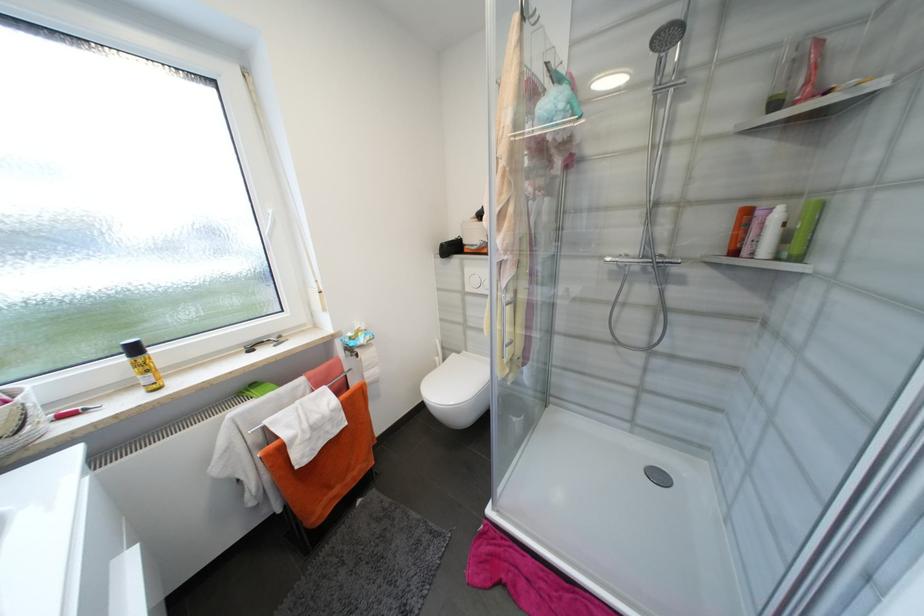
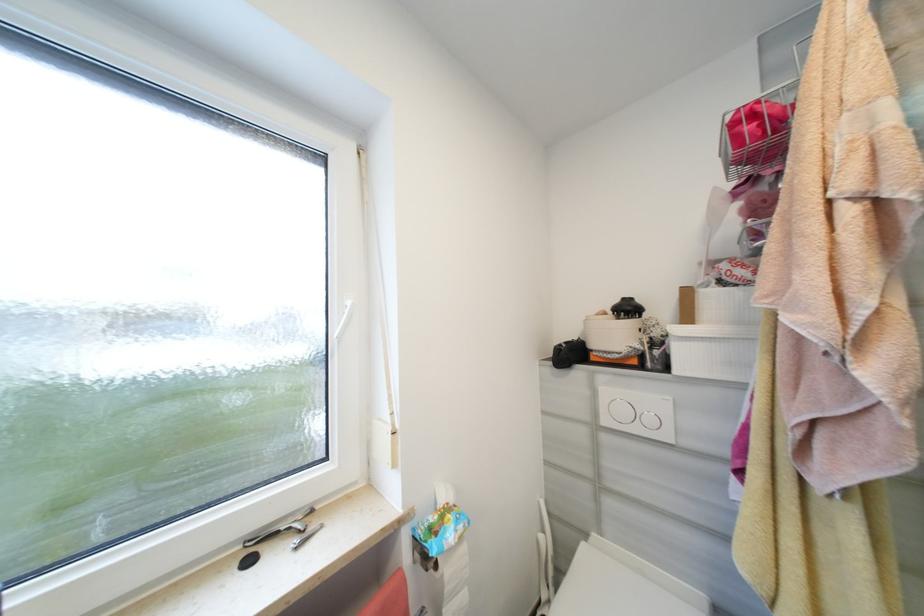
What movement of the cameraman would produce the second image?

The movement direction of the cameraman is left, forward.